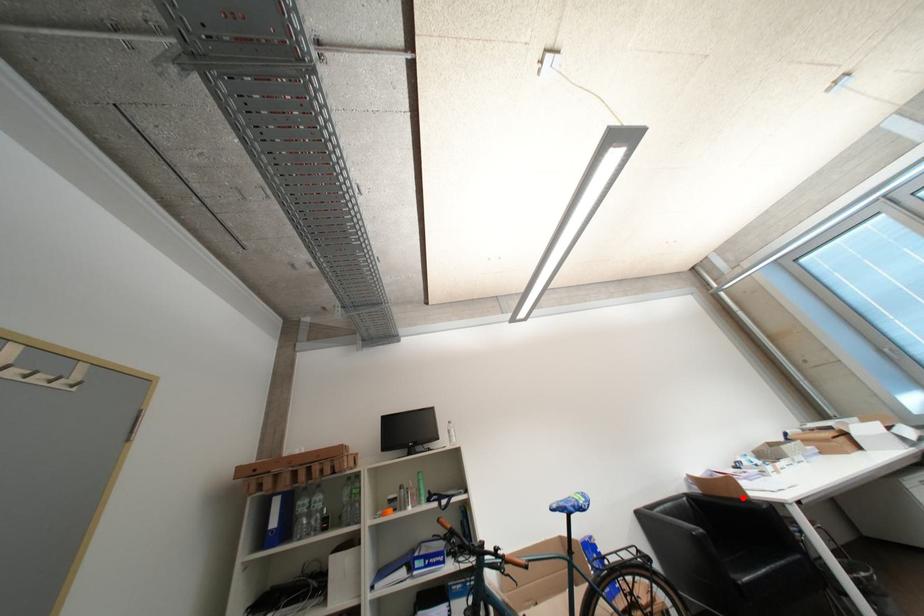
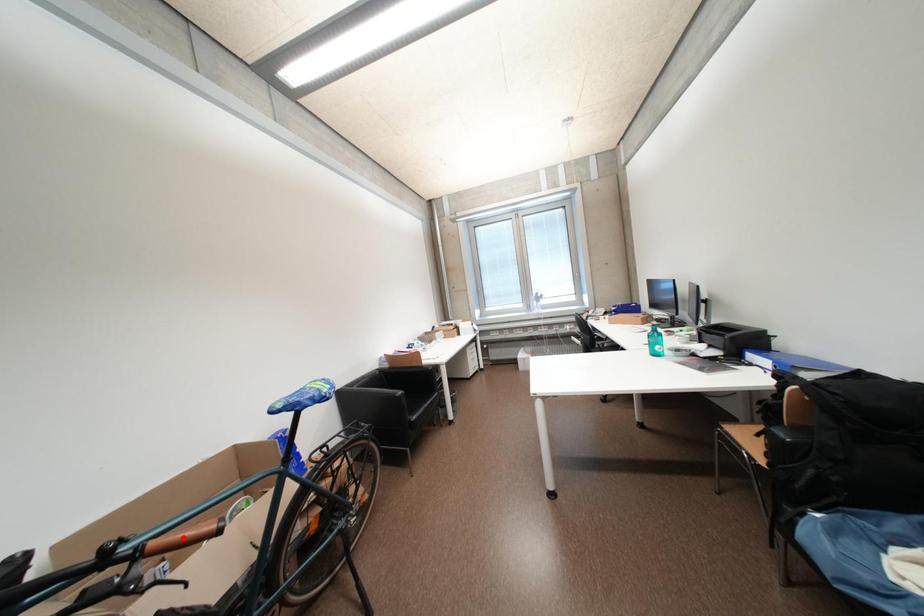
I am providing you with two images of the same scene from different viewpoints. A red point is marked on the first image and another point is marked on the second image. Is the marked point in image1 the same physical position as the marked point in image2?

No